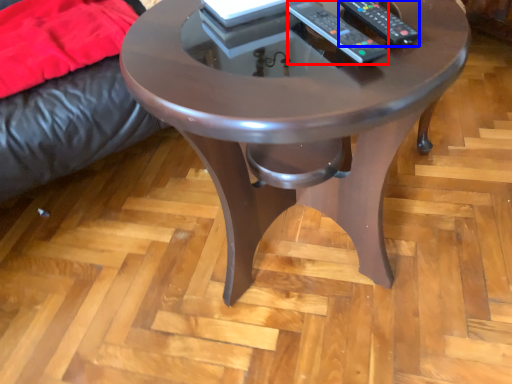
Question: Which point is further to the camera, remote (highlighted by a red box) or remote (highlighted by a blue box)?

Choices:
 (A) remote
 (B) remote

Answer: (B)